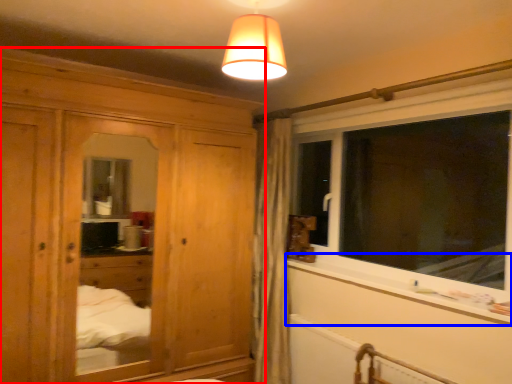
Question: Which object appears closest to the camera in this image, cabinetry (highlighted by a red box) or window sill (highlighted by a blue box)?

Choices:
 (A) cabinetry
 (B) window sill

Answer: (B)